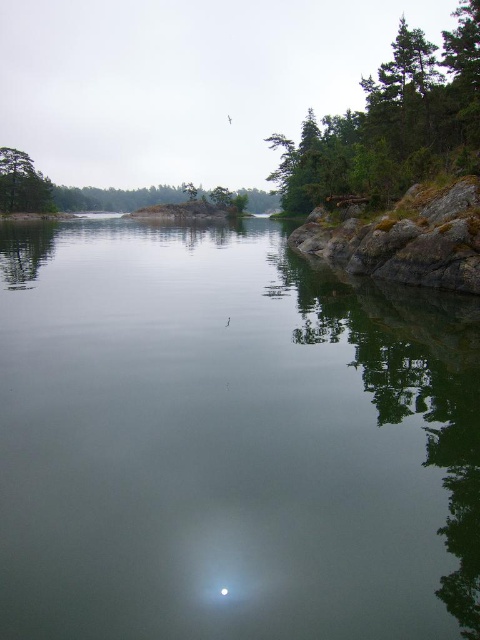
Consider the image. You are an ornithologist observing the scene and need to determine the best spot to watch the bird flying near the center. Considering the transparent water at center and the green leafy tree at upper right, which object is closer to the bird to provide a better vantage point?

The transparent water at center is closer to the bird than the green leafy tree at upper right, so it would provide a better vantage point for observing the bird.